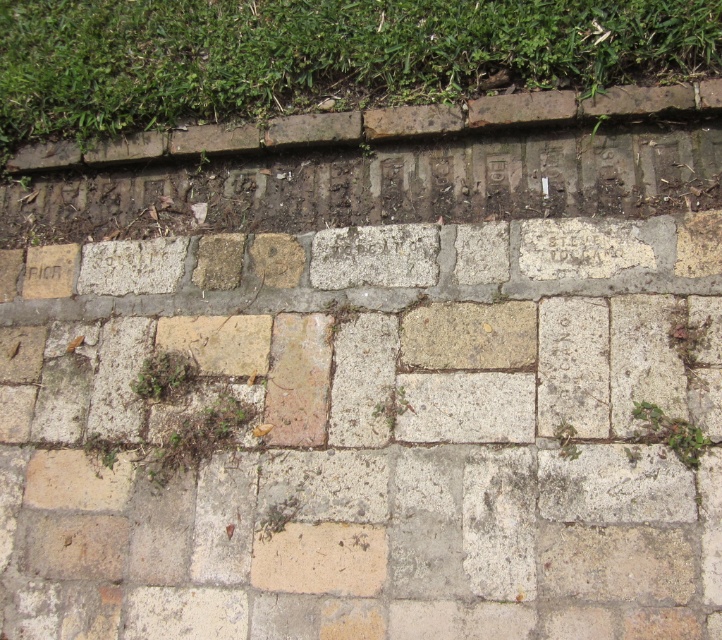
You are a gardener looking at the brick wall with a grassy area above it. You notice the green grass at upper center and the green leafy weed at center. Which of these two plants is bigger?

The green grass at upper center is larger than the green leafy weed at center.

You are standing in front of a brick wall with a grassy area above it. You see the natural stone pavement at center and the green grass at upper center. Which object is taller?

The natural stone pavement at center is much taller than the green grass at upper center.

You are standing in front of a brick wall with a grassy area above it. You need to locate the light brown stone brick at left. Where exactly would you look on the wall?

The light brown stone brick at left is located at point (51, 269) on the wall.